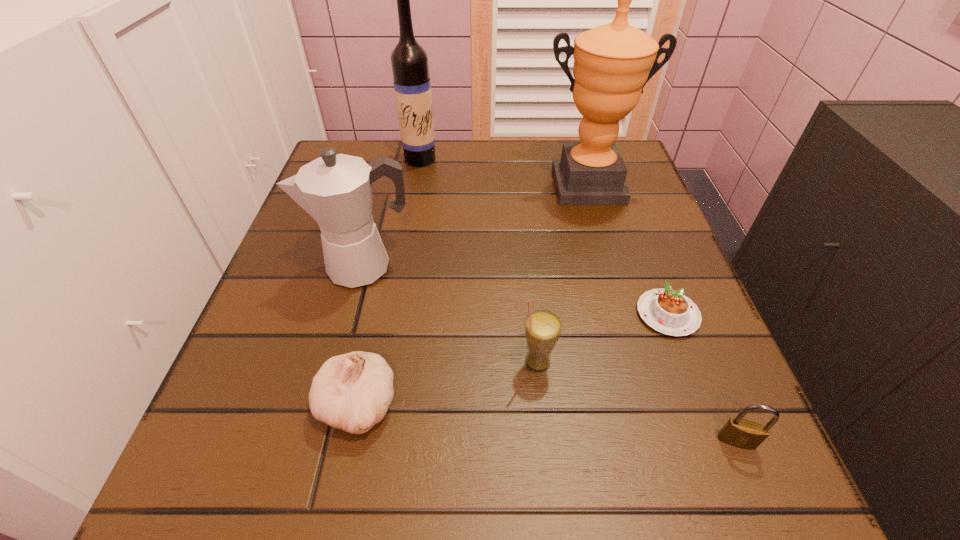
Where is `award`? award is located at coordinates (612, 63).

Where is `wine bottle`? wine bottle is located at coordinates (412, 86).

I want to click on the third tallest object, so click(336, 190).

Identify the location of coffeepot. (336, 190).

Identify the location of the fourth object from right to left. (543, 327).

Where is `the fourth shortest object`? The width and height of the screenshot is (960, 540). the fourth shortest object is located at coordinates 543,327.

The height and width of the screenshot is (540, 960). Identify the location of garlic. (352, 392).

At what (x,y) coordinates should I click in order to perform the action: click on padlock. Please return your answer as a coordinate pair (x, y). Looking at the image, I should click on (737, 432).

Find the location of a particular element. the shortest object is located at coordinates (670, 312).

Identify the location of the fourth nearest object. The height and width of the screenshot is (540, 960). (670, 312).